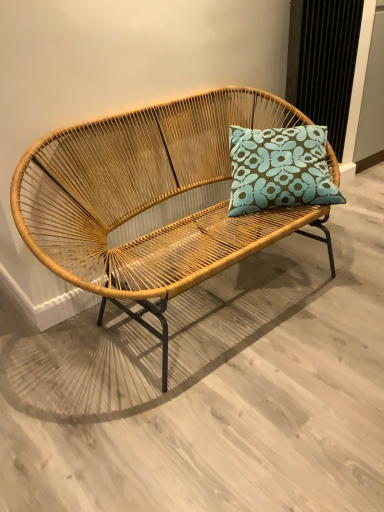
Question: Based on their positions, is teal floral cushion at center located to the left or right of natural woven studio couch at center?

Choices:
 (A) right
 (B) left

Answer: (A)

Question: From the image's perspective, relative to natural woven studio couch at center, is teal floral cushion at center above or below?

Choices:
 (A) below
 (B) above

Answer: (B)

Question: In the image, is teal floral cushion at center positioned in front of or behind natural woven studio couch at center?

Choices:
 (A) front
 (B) behind

Answer: (B)

Question: In terms of size, does natural woven studio couch at center appear bigger or smaller than teal floral cushion at center?

Choices:
 (A) big
 (B) small

Answer: (A)

Question: Is natural woven studio couch at center spatially inside teal floral cushion at center, or outside of it?

Choices:
 (A) outside
 (B) inside

Answer: (A)

Question: Is natural woven studio couch at center in front of or behind teal floral cushion at center in the image?

Choices:
 (A) behind
 (B) front

Answer: (B)

Question: From the image's perspective, relative to teal floral cushion at center, is natural woven studio couch at center above or below?

Choices:
 (A) below
 (B) above

Answer: (A)